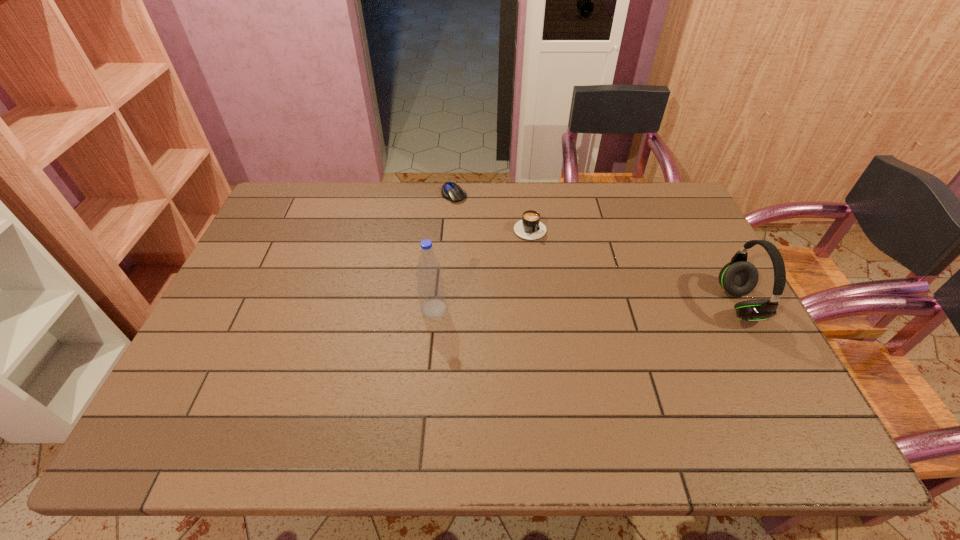
The image size is (960, 540). I want to click on vacant space on the desktop that is between the water bottle and the headset and is positioned with the handle on the side of the third tallest object, so click(x=595, y=307).

Locate an element on the screen. The height and width of the screenshot is (540, 960). vacant space on the desktop that is between the water bottle and the second tallest object and is positioned on the button side of the farthest object is located at coordinates (543, 307).